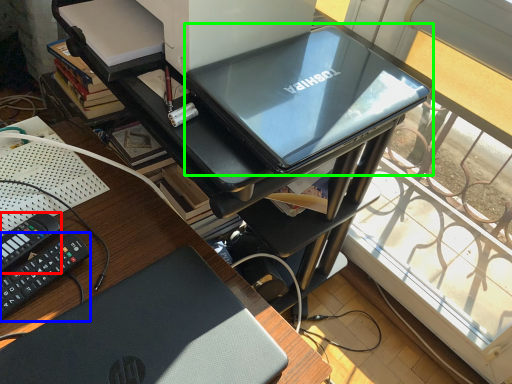
Question: Which object is positioned closest to equipment (highlighted by a red box)? Select from equipment (highlighted by a blue box) and computer (highlighted by a green box).

Choices:
 (A) equipment
 (B) computer

Answer: (A)